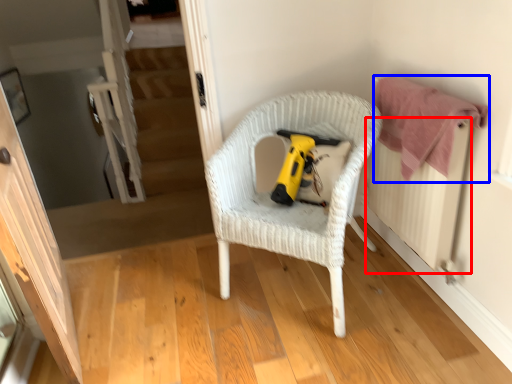
Question: Which point is further to the camera, radiator (highlighted by a red box) or clothe (highlighted by a blue box)?

Choices:
 (A) radiator
 (B) clothe

Answer: (B)